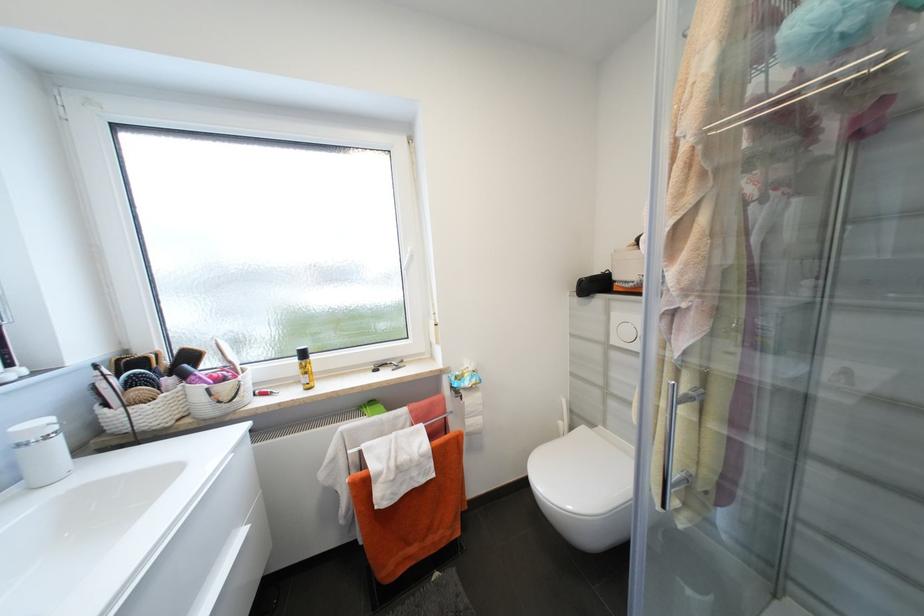
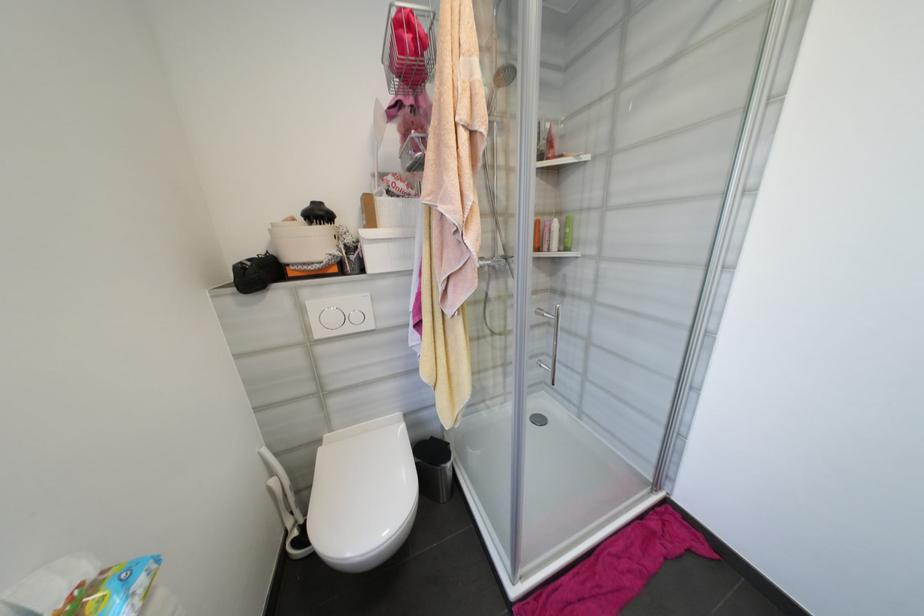
In the second image, find the point that corresponds to (565,424) in the first image.

(277, 482)